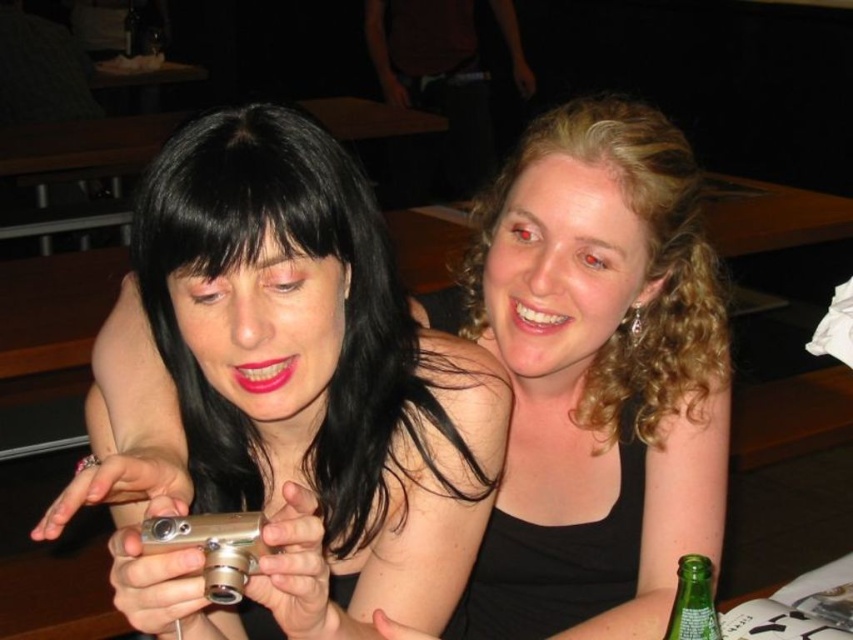
Question: Which of the following is the closest to the observer?

Choices:
 (A) green glass bottle at lower right
 (B) matte silver camera at center

Answer: (A)

Question: Which point is farther to the camera?

Choices:
 (A) 582,113
 (B) 688,572

Answer: (A)

Question: Is matte silver camera at center closer to the viewer compared to green glass bottle at lower right?

Choices:
 (A) yes
 (B) no

Answer: (B)

Question: Is matte silver camera at center bigger than green glass bottle at lower right?

Choices:
 (A) yes
 (B) no

Answer: (A)

Question: Is matte silver camera at center above green glass bottle at lower right?

Choices:
 (A) no
 (B) yes

Answer: (B)

Question: Among these points, which one is farthest from the camera?

Choices:
 (A) (695, 554)
 (B) (596, 250)

Answer: (B)